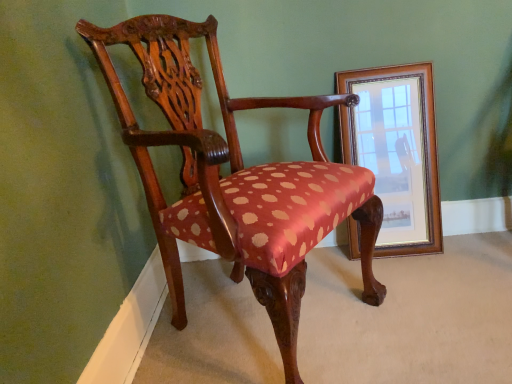
Question: Does wooden framed mirror at right have a greater width compared to polished wood chair at center?

Choices:
 (A) yes
 (B) no

Answer: (B)

Question: From the image's perspective, is wooden framed mirror at right on top of polished wood chair at center?

Choices:
 (A) no
 (B) yes

Answer: (B)

Question: Considering the relative sizes of wooden framed mirror at right and polished wood chair at center in the image provided, is wooden framed mirror at right smaller than polished wood chair at center?

Choices:
 (A) no
 (B) yes

Answer: (B)

Question: Would you say wooden framed mirror at right is outside polished wood chair at center?

Choices:
 (A) yes
 (B) no

Answer: (A)

Question: From a real-world perspective, is wooden framed mirror at right located beneath polished wood chair at center?

Choices:
 (A) yes
 (B) no

Answer: (A)

Question: Would you consider wooden framed mirror at right to be distant from polished wood chair at center?

Choices:
 (A) no
 (B) yes

Answer: (A)

Question: Is polished wood chair at center turned away from wooden framed mirror at right?

Choices:
 (A) no
 (B) yes

Answer: (A)

Question: Is wooden framed mirror at right inside polished wood chair at center?

Choices:
 (A) yes
 (B) no

Answer: (B)

Question: Considering the relative positions of polished wood chair at center and wooden framed mirror at right in the image provided, is polished wood chair at center to the right of wooden framed mirror at right from the viewer's perspective?

Choices:
 (A) yes
 (B) no

Answer: (B)

Question: Does polished wood chair at center lie in front of wooden framed mirror at right?

Choices:
 (A) yes
 (B) no

Answer: (A)

Question: From the image's perspective, is polished wood chair at center on top of wooden framed mirror at right?

Choices:
 (A) yes
 (B) no

Answer: (B)

Question: Is polished wood chair at center further to camera compared to wooden framed mirror at right?

Choices:
 (A) yes
 (B) no

Answer: (B)

Question: Considering the positions of point (421, 226) and point (300, 299), is point (421, 226) closer or farther from the camera than point (300, 299)?

Choices:
 (A) closer
 (B) farther

Answer: (B)